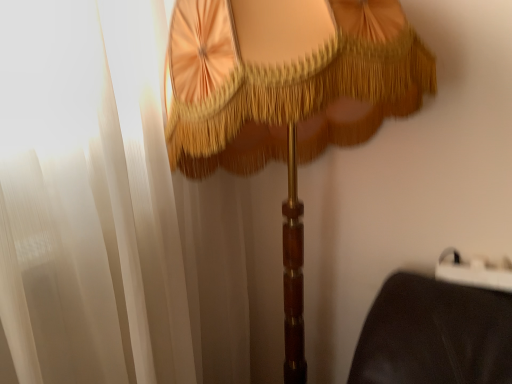
Locate an element on the screen. Image resolution: width=512 pixels, height=384 pixels. matte gold fabric umbrella at center is located at coordinates (286, 98).

Image resolution: width=512 pixels, height=384 pixels. What do you see at coordinates (286, 98) in the screenshot? I see `matte gold fabric umbrella at center` at bounding box center [286, 98].

What is the approximate height of matte gold fabric umbrella at center?

It is 4.32 feet.

At what (x,y) coordinates should I click in order to perform the action: click on matte gold fabric umbrella at center. Please return your answer as a coordinate pair (x, y). This screenshot has height=384, width=512. Looking at the image, I should click on (286, 98).